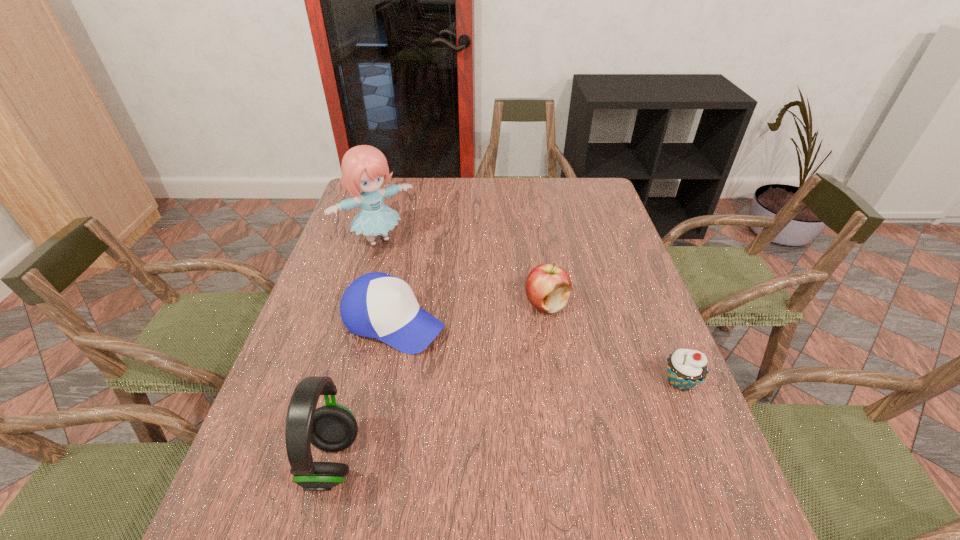
You are a GUI agent. You are given a task and a screenshot of the screen. Output one action in this format:
    pyautogui.click(x=<x>, y=<y>)
    Task: Click on the vacant space on the desktop that is between the nearest object and the cupcake and is positioned on the front-facing side of the doll
    This screenshot has width=960, height=540.
    Given the screenshot: What is the action you would take?
    pyautogui.click(x=531, y=416)

The image size is (960, 540). Identify the location of free space on the desktop that is between the fourth shortest object and the second nearest object and is positioned on the front-facing side of the baseball cap. (565, 408).

Where is `vacant space on the desktop that is between the nearest object and the cupcake and is positioned on the bitten side of the apple`? The width and height of the screenshot is (960, 540). vacant space on the desktop that is between the nearest object and the cupcake and is positioned on the bitten side of the apple is located at coordinates (525, 417).